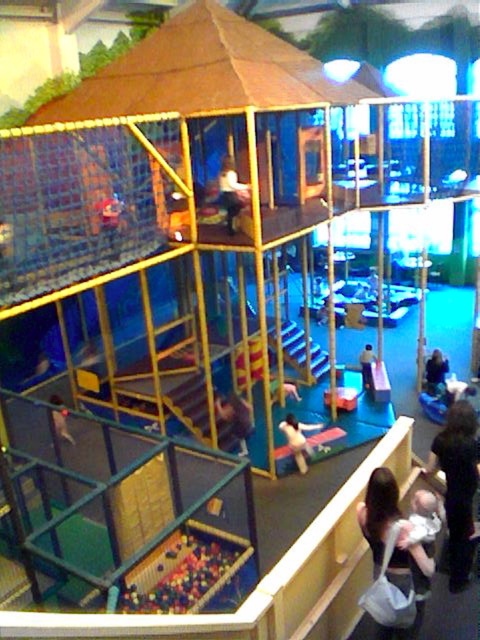
You are a parent supervising children in the play area. You notice a smooth white shirt at center and multicolored plastic balls at lower center. Which object is located below the other?

The multicolored plastic balls at lower center is positioned under smooth white shirt at center.

You are standing in the indoor play area and want to reach the pyramid playhouse at the top. You notice two points marked in the scene. Which point is closer to you, point (192,541) or point (359,362)?

Point (192,541) is closer to the viewer than point (359,362).

You are a parent supervising children in the play area. You notice two children with distinct hair colors and positions. The first has dark brown hair at lower right, and the second has smooth brown hair at center. Which child is standing higher up in the play area?

The dark brown hair at lower right is much taller than smooth brown hair at center, so the child with dark brown hair at lower right is standing higher up in the play area.